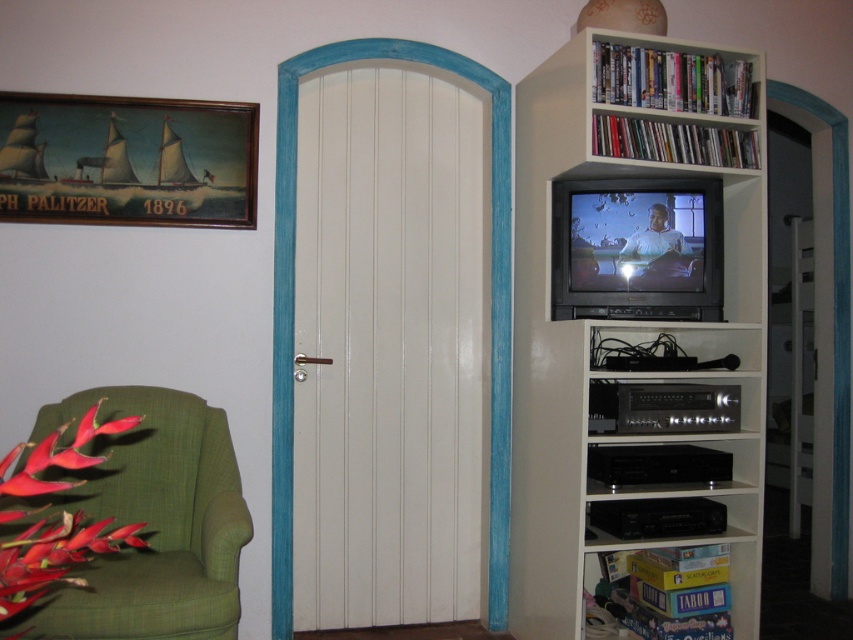
You are standing in the living room and want to hang a new picture exactly where the wooden framed painting at upper left is currently located. What are the coordinates you should use for hanging the new picture?

The coordinates for the wooden framed painting at upper left are at point (126, 161), so you should use those coordinates to hang the new picture.

You are an interior designer planning to place a new 4 feet wide sofa between the white matte bookcase at upper right and the wooden framed painting at upper left. Based on the current spacing between them, will the sofa fit comfortably without being too cramped?

The white matte bookcase at upper right is 4.36 feet from the wooden framed painting at upper left. Since the sofa is 4 feet wide, it will fit comfortably with a small amount of space remaining between the two objects.